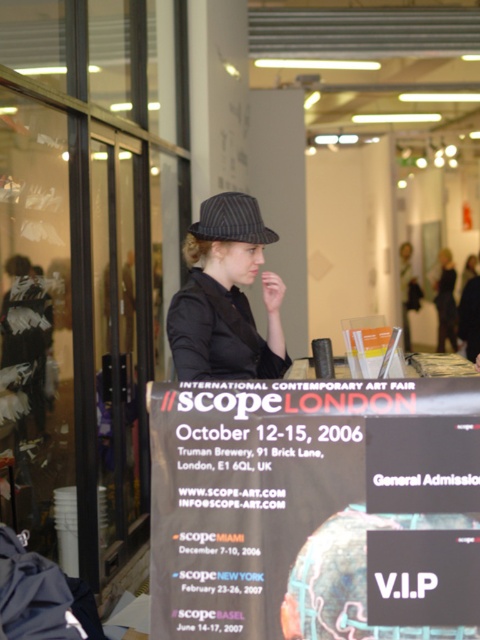
Question: Which point is closer to the camera taking this photo?

Choices:
 (A) tap(256, 371)
 (B) tap(232, 220)

Answer: (B)

Question: Can you confirm if striped fabric hat at center is positioned above striped fabric baseball hat at center?

Choices:
 (A) yes
 (B) no

Answer: (B)

Question: Is striped fabric hat at center to the right of striped fabric baseball hat at center from the viewer's perspective?

Choices:
 (A) no
 (B) yes

Answer: (A)

Question: Which of the following is the closest to the observer?

Choices:
 (A) striped fabric baseball hat at center
 (B) striped fabric hat at center

Answer: (B)

Question: Which point is farther to the camera?

Choices:
 (A) (231, 280)
 (B) (248, 230)

Answer: (A)

Question: Is striped fabric hat at center to the left of striped fabric baseball hat at center from the viewer's perspective?

Choices:
 (A) yes
 (B) no

Answer: (A)